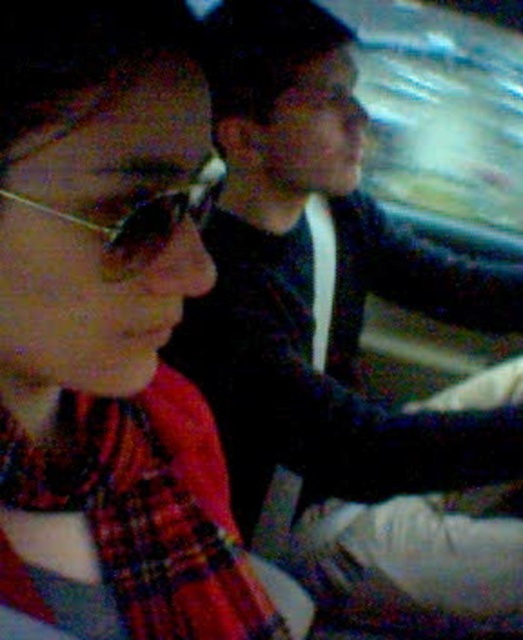
You are sitting in the backseat of a car and see the plaid fabric scarf at left. Can you reach it if you extend your arm 0.5 meters forward?

The plaid fabric scarf at left is located at point (x=110, y=339) which is within the 0.5 meters reach of your extended arm, so yes you can reach it.

You are a fashion designer observing two accessories in the scene. The first is the plaid fabric scarf at left, and the second is the metallic reflective glasses at upper left. Which accessory is located closer to the right side of the image?

The plaid fabric scarf at left is positioned on the right side of metallic reflective glasses at upper left, so the plaid fabric scarf at left is closer to the right side of the image.